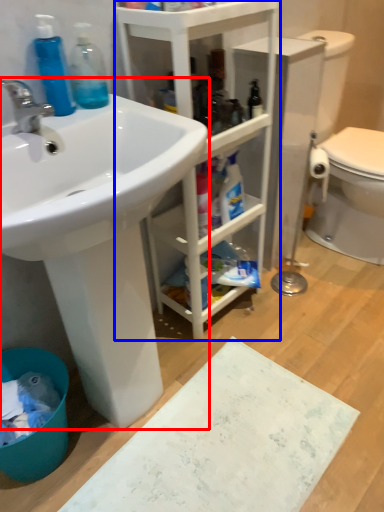
Question: Which of the following is the closest to the observer, sink (highlighted by a red box) or bathroom cabinet (highlighted by a blue box)?

Choices:
 (A) sink
 (B) bathroom cabinet

Answer: (A)